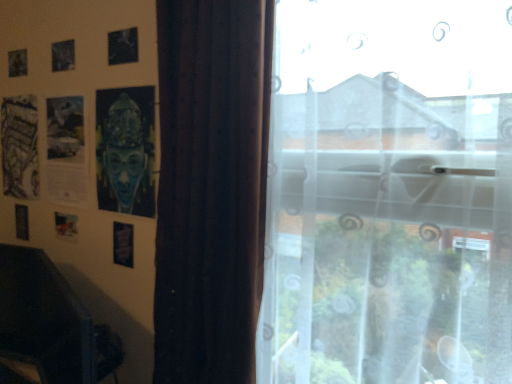
Question: Is there a large distance between blue matte mask at upper left and transparent sheer curtain at right?

Choices:
 (A) yes
 (B) no

Answer: (B)

Question: Considering the relative positions of blue matte mask at upper left and transparent sheer curtain at right in the image provided, is blue matte mask at upper left to the right of transparent sheer curtain at right from the viewer's perspective?

Choices:
 (A) yes
 (B) no

Answer: (B)

Question: Can you confirm if blue matte mask at upper left is thinner than transparent sheer curtain at right?

Choices:
 (A) yes
 (B) no

Answer: (A)

Question: Can you confirm if blue matte mask at upper left is wider than transparent sheer curtain at right?

Choices:
 (A) no
 (B) yes

Answer: (A)

Question: From the image's perspective, would you say blue matte mask at upper left is positioned over transparent sheer curtain at right?

Choices:
 (A) no
 (B) yes

Answer: (B)

Question: Which is correct: transparent sheer curtain at right is inside blue matte mask at upper left, or outside of it?

Choices:
 (A) outside
 (B) inside

Answer: (A)

Question: From the image's perspective, is transparent sheer curtain at right located above or below blue matte mask at upper left?

Choices:
 (A) above
 (B) below

Answer: (B)

Question: Looking at their shapes, would you say transparent sheer curtain at right is wider or thinner than blue matte mask at upper left?

Choices:
 (A) thin
 (B) wide

Answer: (B)

Question: In terms of size, does transparent sheer curtain at right appear bigger or smaller than blue matte mask at upper left?

Choices:
 (A) small
 (B) big

Answer: (B)

Question: From the image's perspective, relative to transparent sheer curtain at right, is metallic silver picture frame at lower left above or below?

Choices:
 (A) below
 (B) above

Answer: (A)

Question: Does point (114, 248) appear closer or farther from the camera than point (502, 213)?

Choices:
 (A) farther
 (B) closer

Answer: (A)

Question: Would you say metallic silver picture frame at lower left is to the left or to the right of transparent sheer curtain at right in the picture?

Choices:
 (A) left
 (B) right

Answer: (A)

Question: From their relative heights in the image, would you say metallic silver picture frame at lower left is taller or shorter than transparent sheer curtain at right?

Choices:
 (A) tall
 (B) short

Answer: (B)

Question: Considering the positions of blue matte mask at upper left and metallic silver picture frame at lower left in the image, is blue matte mask at upper left taller or shorter than metallic silver picture frame at lower left?

Choices:
 (A) short
 (B) tall

Answer: (B)

Question: From the image's perspective, is blue matte mask at upper left positioned above or below metallic silver picture frame at lower left?

Choices:
 (A) above
 (B) below

Answer: (A)